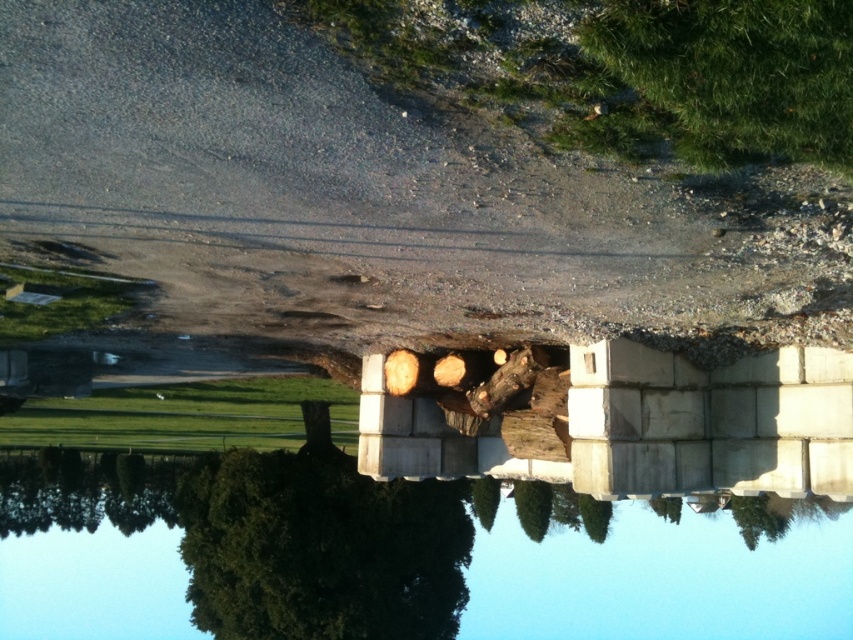
Question: Which object is positioned farthest from the green leafy tree at center?

Choices:
 (A) green fuzzy tree at upper center
 (B) transparent concrete water at center
 (C) wooden log at center

Answer: (A)

Question: Is green fuzzy tree at upper center to the right of wooden log at center from the viewer's perspective?

Choices:
 (A) no
 (B) yes

Answer: (B)

Question: Which point is farther to the camera?

Choices:
 (A) (763, 48)
 (B) (773, 497)
 (C) (537, 362)
 (D) (445, 500)

Answer: (B)

Question: Does transparent concrete water at center appear on the left side of green fuzzy tree at upper center?

Choices:
 (A) yes
 (B) no

Answer: (B)

Question: Which object is farther from the camera taking this photo?

Choices:
 (A) wooden log at center
 (B) transparent concrete water at center

Answer: (B)

Question: Can you confirm if transparent concrete water at center is bigger than green leafy tree at center?

Choices:
 (A) yes
 (B) no

Answer: (A)